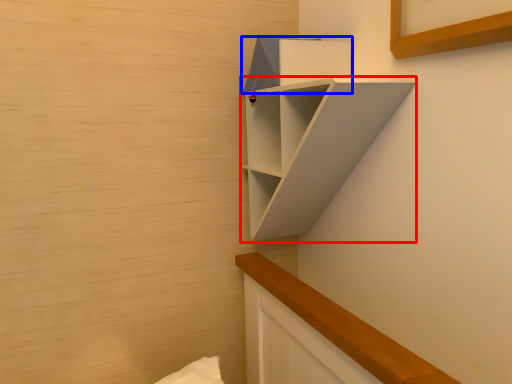
Question: Which point is closer to the camera, shelf (highlighted by a red box) or cabinet (highlighted by a blue box)?

Choices:
 (A) shelf
 (B) cabinet

Answer: (A)